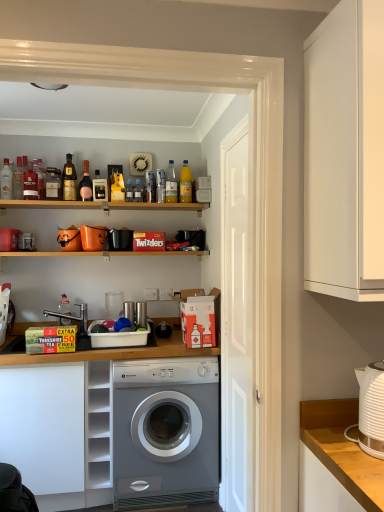
Identify the location of matte black kettle at left, the third appliance from the front. (9, 239).

Describe the element at coordinates (237, 319) in the screenshot. I see `white matte door at center` at that location.

Locate an element on the screen. This screenshot has width=384, height=512. matte black kettle at left, the second appliance in the back-to-front sequence is located at coordinates pyautogui.click(x=9, y=239).

Is white plastic dish rack at center, acting as the second appliance starting from the left, to the left of brushed metal soap dispenser at lower left, acting as the 3th bottle starting from the left, from the viewer's perspective?

In fact, white plastic dish rack at center, acting as the second appliance starting from the left, is to the right of brushed metal soap dispenser at lower left, acting as the 3th bottle starting from the left.

Is white plastic dish rack at center, the second appliance in the front-to-back sequence, facing away from brushed metal soap dispenser at lower left, acting as the 3th bottle starting from the left?

No, brushed metal soap dispenser at lower left, acting as the 3th bottle starting from the left, is not at the back of white plastic dish rack at center, the second appliance in the front-to-back sequence.

What's the angular difference between white plastic dish rack at center, acting as the second appliance starting from the left, and brushed metal soap dispenser at lower left, acting as the 3th bottle starting from the left,'s facing directions?

white plastic dish rack at center, acting as the second appliance starting from the left, and brushed metal soap dispenser at lower left, acting as the 3th bottle starting from the left, are facing 0.864 degrees away from each other.

Who is shorter, white plastic dish rack at center, which is counted as the third appliance, starting from the back, or brushed metal soap dispenser at lower left, acting as the 3th bottle starting from the left?

With less height is white plastic dish rack at center, which is counted as the third appliance, starting from the back.

Looking at this image, from a real-world perspective, does translucent amber bottle at upper left, marked as the 1th bottle in a left-to-right arrangement, stand above shiny gold bottle at upper left, acting as the 6th bottle starting from the right?

No.

Would you consider translucent amber bottle at upper left, arranged as the 9th bottle when viewed from the right, to be distant from shiny gold bottle at upper left, acting as the 6th bottle starting from the right?

translucent amber bottle at upper left, arranged as the 9th bottle when viewed from the right, is near shiny gold bottle at upper left, acting as the 6th bottle starting from the right, not far away.

Who is bigger, translucent amber bottle at upper left, arranged as the 9th bottle when viewed from the right, or shiny gold bottle at upper left, placed as the 4th bottle when sorted from left to right?

With larger size is shiny gold bottle at upper left, placed as the 4th bottle when sorted from left to right.

Can you confirm if translucent amber bottle at upper left, arranged as the 9th bottle when viewed from the right, is shorter than yellow glass bottle at upper center, which is the first bottle in right-to-left order?

Yes, translucent amber bottle at upper left, arranged as the 9th bottle when viewed from the right, is shorter than yellow glass bottle at upper center, which is the first bottle in right-to-left order.

Considering the sizes of objects translucent amber bottle at upper left, arranged as the 9th bottle when viewed from the right, and yellow glass bottle at upper center, which is the first bottle in right-to-left order, in the image provided, who is thinner, translucent amber bottle at upper left, arranged as the 9th bottle when viewed from the right, or yellow glass bottle at upper center, which is the first bottle in right-to-left order,?

yellow glass bottle at upper center, which is the first bottle in right-to-left order.

Considering the points (39, 164) and (183, 184), which point is behind, point (39, 164) or point (183, 184)?

Point (39, 164)

From the image's perspective, which bottle is the 4th one below the yellow glass bottle at upper center, the ninth bottle from the left? Please provide its 2D coordinates.

[(39, 178)]

From the picture: From the image's perspective, is brushed metal soap dispenser at lower left, which appears as the seventh bottle when viewed from the right, over pink glass bottle at upper center, marked as the fifth bottle in a right-to-left arrangement?

Incorrect, from the image's perspective, brushed metal soap dispenser at lower left, which appears as the seventh bottle when viewed from the right, is lower than pink glass bottle at upper center, marked as the fifth bottle in a right-to-left arrangement.

Locate an element on the screen. The height and width of the screenshot is (512, 384). bottle that is the 4th one above the brushed metal soap dispenser at lower left, which appears as the seventh bottle when viewed from the right (from a real-world perspective) is located at coordinates (85, 184).

Is brushed metal soap dispenser at lower left, acting as the 3th bottle starting from the left, wider than pink glass bottle at upper center, marked as the fifth bottle in a right-to-left arrangement?

Correct, the width of brushed metal soap dispenser at lower left, acting as the 3th bottle starting from the left, exceeds that of pink glass bottle at upper center, marked as the fifth bottle in a right-to-left arrangement.

Which object is positioned more to the left, matte glass bottle at upper center, which is the 4th bottle from right to left, or white plastic dish rack at center, acting as the second appliance starting from the left?

From the viewer's perspective, matte glass bottle at upper center, which is the 4th bottle from right to left, appears more on the left side.

Is matte glass bottle at upper center, positioned as the sixth bottle in left-to-right order, far away from white plastic dish rack at center, which is the 4th appliance in top-to-bottom order?

Actually, matte glass bottle at upper center, positioned as the sixth bottle in left-to-right order, and white plastic dish rack at center, which is the 4th appliance in top-to-bottom order, are a little close together.

How far apart are matte glass bottle at upper center, which is the 4th bottle from right to left, and white plastic dish rack at center, arranged as the 3th appliance when viewed from the right?

matte glass bottle at upper center, which is the 4th bottle from right to left, and white plastic dish rack at center, arranged as the 3th appliance when viewed from the right, are 85.10 centimeters apart from each other.

Where is `appliance that is the 4th one when counting downward from the matte glass bottle at upper center, positioned as the sixth bottle in left-to-right order (from the image's perspective)`? This screenshot has width=384, height=512. appliance that is the 4th one when counting downward from the matte glass bottle at upper center, positioned as the sixth bottle in left-to-right order (from the image's perspective) is located at coordinates (117, 337).

Is matte glass bottle at upper center, positioned as the sixth bottle in left-to-right order, a part of pink glass bottle at upper center, marked as the fifth bottle in a right-to-left arrangement?

No, pink glass bottle at upper center, marked as the fifth bottle in a right-to-left arrangement, does not contain matte glass bottle at upper center, positioned as the sixth bottle in left-to-right order.

How different are the orientations of pink glass bottle at upper center, marked as the fifth bottle in a right-to-left arrangement, and matte glass bottle at upper center, which is the 4th bottle from right to left, in degrees?

1.3 degrees.

Starting from the pink glass bottle at upper center, marked as the fifth bottle in a right-to-left arrangement, which bottle is the 1st one in front? Please provide its 2D coordinates.

[(117, 187)]

In terms of width, does pink glass bottle at upper center, marked as the fifth bottle in a right-to-left arrangement, look wider or thinner when compared to matte glass bottle at upper center, which is the 4th bottle from right to left?

In the image, pink glass bottle at upper center, marked as the fifth bottle in a right-to-left arrangement, appears to be more narrow than matte glass bottle at upper center, which is the 4th bottle from right to left.

In the scene shown: From a real-world perspective, which object rests below the other?

yellow cardboard box at lower left.

Between yellow cardboard box at lower left and matte glass wine bottle at upper left, positioned as the eighth bottle in right-to-left order, which one is positioned behind?

matte glass wine bottle at upper left, positioned as the eighth bottle in right-to-left order.

Is yellow cardboard box at lower left looking in the opposite direction of matte glass wine bottle at upper left, which is the second bottle in left-to-right order?

No, matte glass wine bottle at upper left, which is the second bottle in left-to-right order, is not at the back of yellow cardboard box at lower left.

Is point (66, 364) positioned before point (56, 193)?

Yes, point (66, 364) is in front of point (56, 193).

Find the location of a particular element. Image resolution: width=384 pixels, height=512 pixels. the 2nd appliance positioned below the brushed metal soap dispenser at lower left, which appears as the seventh bottle when viewed from the right (from a real-world perspective) is located at coordinates (117, 337).

Locate an element on the screen. This screenshot has height=512, width=384. the 5th bottle above the translucent amber bottle at upper left, marked as the 1th bottle in a left-to-right arrangement (from the image's perspective) is located at coordinates (69, 180).

From the image, which object appears to be farther from metallic silver washing machine at center, the fourth appliance ordered from the bottom, yellow glass bottle at upper center, the ninth bottle from the left, or shiny gold bottle at upper left, acting as the 6th bottle starting from the right?

The object further to metallic silver washing machine at center, the fourth appliance ordered from the bottom, is shiny gold bottle at upper left, acting as the 6th bottle starting from the right.

Based on their spatial positions, is yellow matte bottle at upper center, placed as the 8th bottle when sorted from left to right, or pink glass bottle at upper center, marked as the fifth bottle in a right-to-left arrangement, further from metallic silver washing machine at center, placed as the 4th appliance when sorted from front to back?

pink glass bottle at upper center, marked as the fifth bottle in a right-to-left arrangement.

Based on the photo, looking at the image, which one is located closer to white plastic dish rack at center, the second appliance in the front-to-back sequence, matte black kettle at left, the second appliance in the back-to-front sequence, or yellow glass bottle at upper center, the ninth bottle from the left?

Among the two, matte black kettle at left, the second appliance in the back-to-front sequence, is located nearer to white plastic dish rack at center, the second appliance in the front-to-back sequence.

Considering their positions, is pink glass bottle at upper center, the fifth bottle in the left-to-right sequence, positioned further to matte glass wine bottle at upper left, positioned as the eighth bottle in right-to-left order, than translucent amber bottle at upper left, arranged as the 9th bottle when viewed from the right?

pink glass bottle at upper center, the fifth bottle in the left-to-right sequence, is further to matte glass wine bottle at upper left, positioned as the eighth bottle in right-to-left order.

Considering their positions, is white plastic kettle at right, which appears as the fourth appliance when viewed from the left, positioned closer to yellow glass bottle at upper center, which is the first bottle in right-to-left order, than yellow cardboard box at lower left?

yellow cardboard box at lower left is positioned closer to the anchor yellow glass bottle at upper center, which is the first bottle in right-to-left order.

From the image, which object appears to be nearer to translucent amber bottle at upper left, marked as the 1th bottle in a left-to-right arrangement, shiny gold bottle at upper left, placed as the 4th bottle when sorted from left to right, or white plastic shelves at lower left?

shiny gold bottle at upper left, placed as the 4th bottle when sorted from left to right, lies closer to translucent amber bottle at upper left, marked as the 1th bottle in a left-to-right arrangement, than the other object.

Which object lies further to the anchor point white plastic dish rack at center, arranged as the 3th appliance when viewed from the right, matte black kettle at left, the second appliance in the back-to-front sequence, or metallic silver washing machine at center, which is counted as the 3th appliance, starting from the left?

Among the two, matte black kettle at left, the second appliance in the back-to-front sequence, is located further to white plastic dish rack at center, arranged as the 3th appliance when viewed from the right.

Based on their spatial positions, is matte glass wine bottle at upper left, positioned as the eighth bottle in right-to-left order, or matte glass bottle at upper center, positioned as the sixth bottle in left-to-right order, further from white glossy sink at lower left?

matte glass bottle at upper center, positioned as the sixth bottle in left-to-right order.

You are a GUI agent. You are given a task and a screenshot of the screen. Output one action in this format:
    pyautogui.click(x=<x>, y=<y>)
    Task: Click on the shelf that lies between white plastic dish rack at center, arranged as the 3th appliance when viewed from the right, and yellow cardboard box at lower left from top to bottom
    This screenshot has height=512, width=384.
    Given the screenshot: What is the action you would take?
    pyautogui.click(x=98, y=433)

Locate an element on the screen. The height and width of the screenshot is (512, 384). shelf between matte black kettle at left, the first appliance positioned from the left, and yellow cardboard box at lower left, in the vertical direction is located at coordinates (98, 433).

The width and height of the screenshot is (384, 512). I want to click on shelf between matte glass bottle at upper center, the 3th bottle viewed from the right, and yellow cardboard box at lower left from top to bottom, so click(x=98, y=433).

Where is `bottle that lies between matte glass wine bottle at upper left, which is the second bottle in left-to-right order, and brushed metal soap dispenser at lower left, acting as the 3th bottle starting from the left, from top to bottom`? bottle that lies between matte glass wine bottle at upper left, which is the second bottle in left-to-right order, and brushed metal soap dispenser at lower left, acting as the 3th bottle starting from the left, from top to bottom is located at coordinates (138, 191).